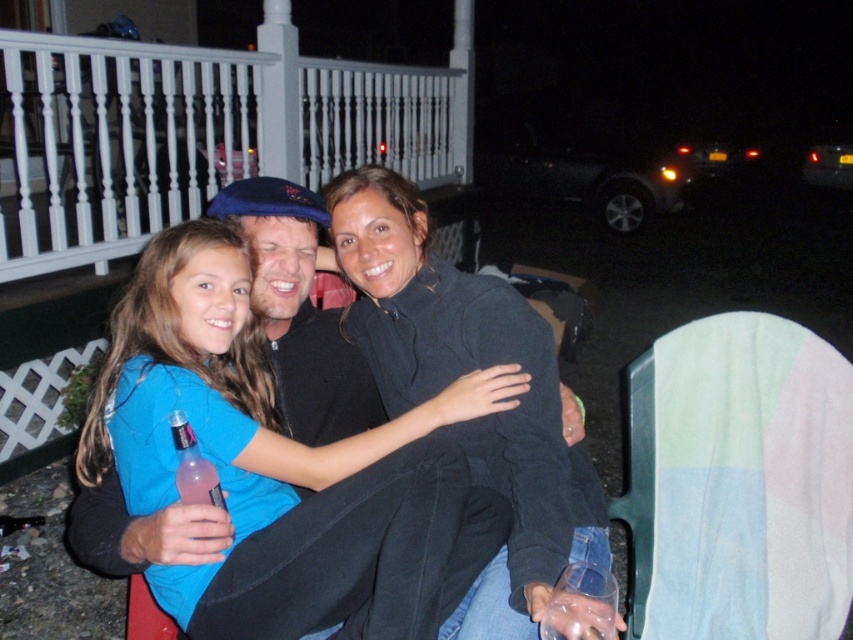
In the nighttime outdoor gathering scene, there are two people wearing blue cotton shirt at center and dark gray sweater at center. Which one is closer to the camera?

The blue cotton shirt at center is closer to the camera because it is in front of the dark gray sweater at center.

You are a photographer trying to capture a group photo of the blue cotton shirt at center and the dark gray sweater at center. Since you want to ensure both subjects are in focus, you need to know which one is closer to the camera. Can you determine which is closer?

The blue cotton shirt at center is smaller than dark gray sweater at center, so the blue cotton shirt at center is closer to the camera because objects that are closer appear smaller in the image.

You are a photographer trying to capture a candid shot of the dark gray sweater at center without including the white painted wood railing at upper left in the frame. Is this possible given their positions?

The dark gray sweater at center is behind the white painted wood railing at upper left, so it is possible to position the camera to capture the dark gray sweater at center without including the railing in the frame.